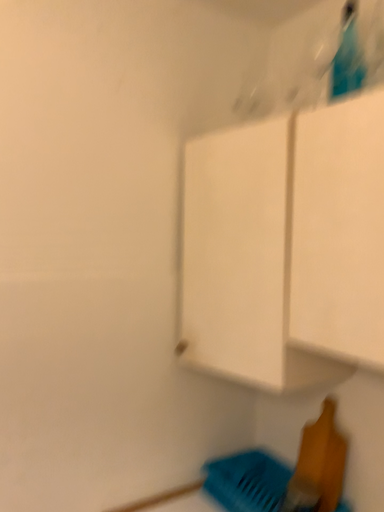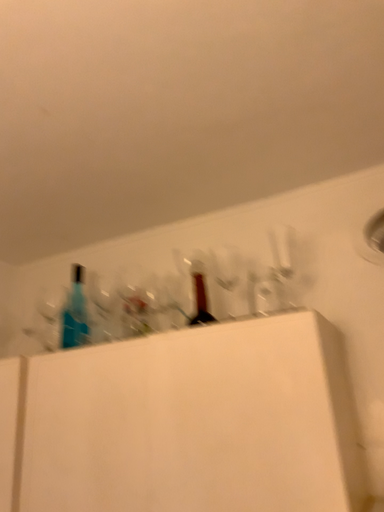
Question: Which way did the camera rotate in the video?

Choices:
 (A) rotated upward
 (B) rotated downward

Answer: (A)